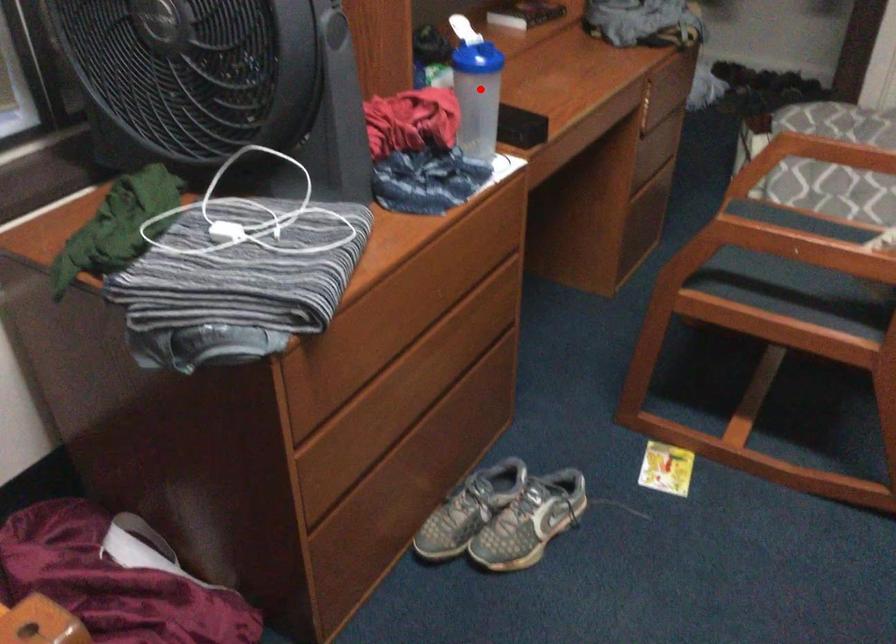
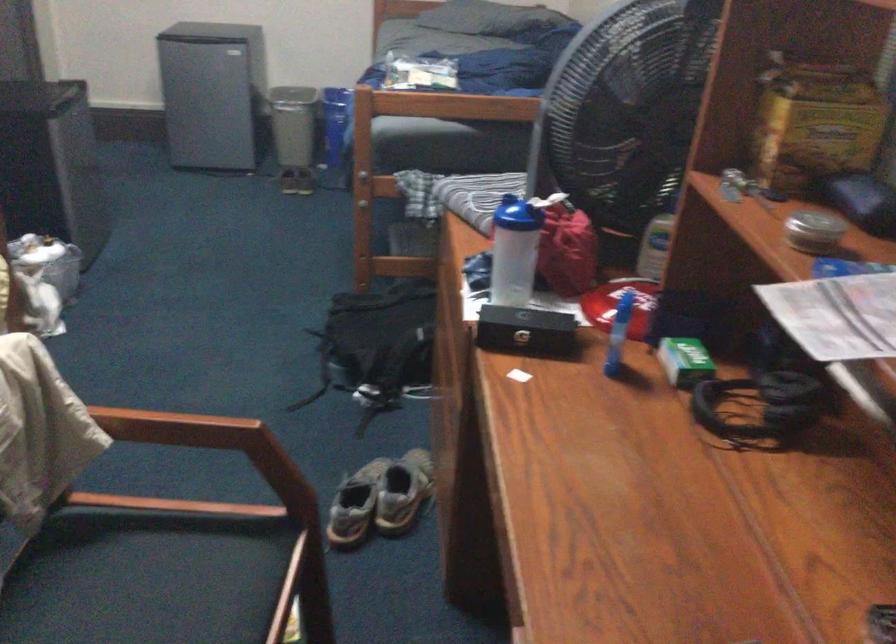
Locate, in the second image, the point that corresponds to the highlighted location in the first image.

(513, 251)